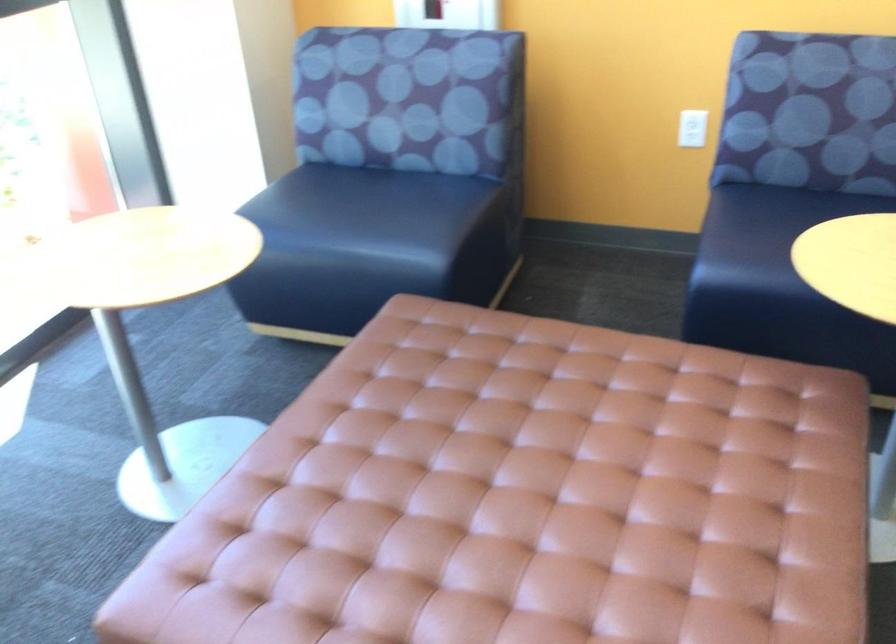
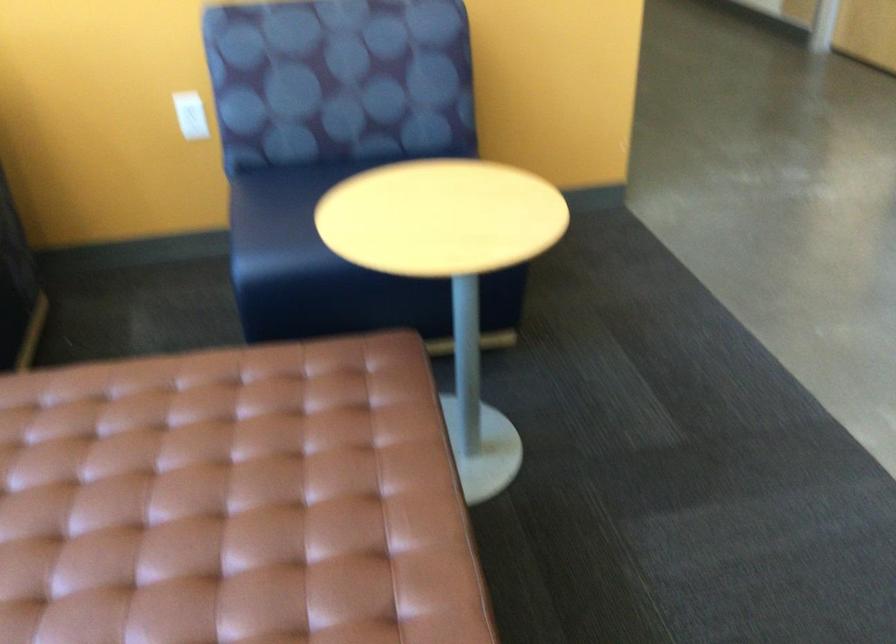
The point at (x=621, y=482) is marked in the first image. Where is the corresponding point in the second image?

(231, 502)